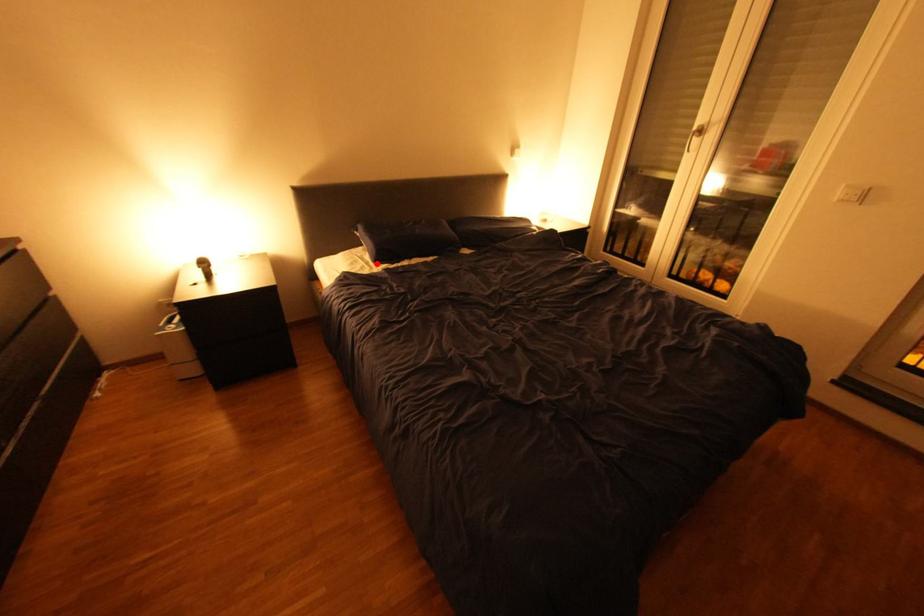
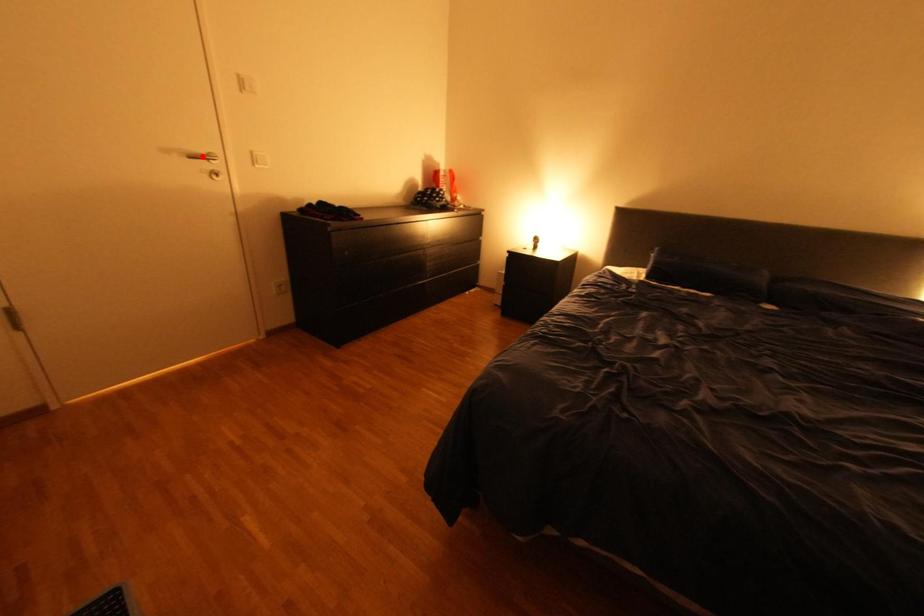
I am providing you with two images of the same scene from different viewpoints. A red point is marked on the first image and another point is marked on the second image. Is the red point in image1 aligned with the point shown in image2?

No